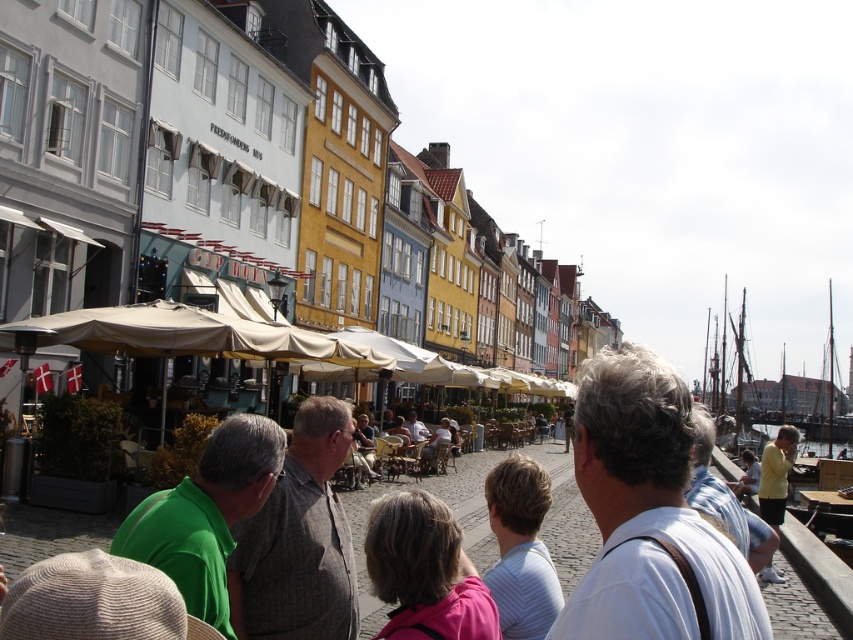
Which of these two, yellow cotton shirt at lower right or yellow shirt at lower right, stands taller?

Standing taller between the two is yellow cotton shirt at lower right.

Does point (762, 490) come behind point (756, 476)?

No, (762, 490) is closer to viewer.

Identify the location of yellow cotton shirt at lower right. The height and width of the screenshot is (640, 853). (776, 476).

Is pink fabric at center positioned before yellow shirt at lower right?

Yes, pink fabric at center is in front of yellow shirt at lower right.

The height and width of the screenshot is (640, 853). What do you see at coordinates (424, 572) in the screenshot? I see `pink fabric at center` at bounding box center [424, 572].

Image resolution: width=853 pixels, height=640 pixels. I want to click on pink fabric at center, so click(424, 572).

Between white fabric shirt at center and light brown wooden chair at center, which one has more height?

Standing taller between the two is white fabric shirt at center.

Which is behind, point (668, 502) or point (434, 451)?

Positioned behind is point (434, 451).

Find the location of a particular element. The width and height of the screenshot is (853, 640). white fabric shirt at center is located at coordinates (647, 513).